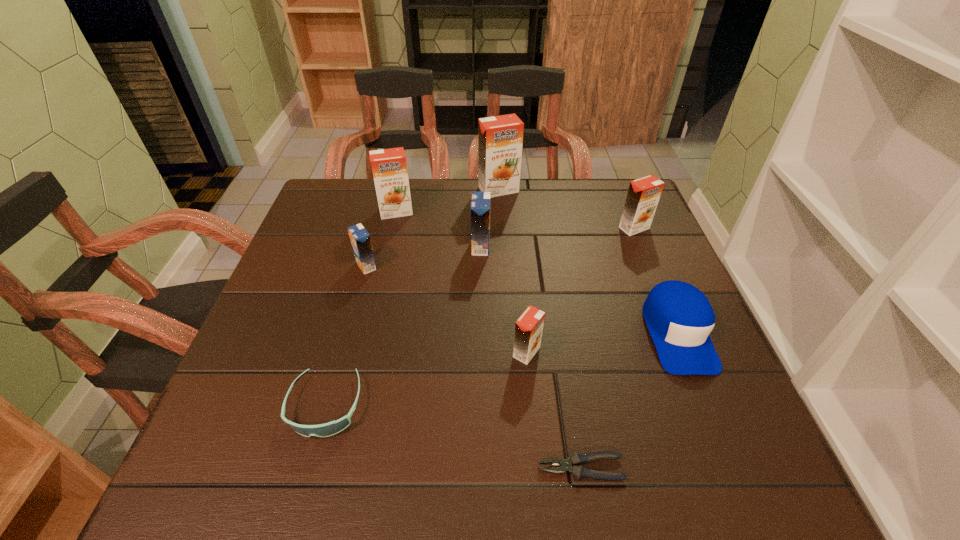
Where is `object that is at the left edge`? The image size is (960, 540). object that is at the left edge is located at coordinates (331, 428).

Find the location of `orange juice that is positioned at the right edge`. orange juice that is positioned at the right edge is located at coordinates (643, 195).

At what (x,y) coordinates should I click in order to perform the action: click on baseball cap that is at the right edge. Please return your answer as a coordinate pair (x, y). Looking at the image, I should click on point(679,317).

Locate an element on the screen. object present at the near left corner is located at coordinates click(x=331, y=428).

Image resolution: width=960 pixels, height=540 pixels. I want to click on object situated at the far right corner, so click(x=643, y=195).

In the image, there is a desktop. Where is `free space at the far edge`? This screenshot has height=540, width=960. free space at the far edge is located at coordinates (467, 207).

In the image, there is a desktop. Identify the location of vacant space at the near edge. Image resolution: width=960 pixels, height=540 pixels. (327, 485).

Where is `vacant space at the left edge of the desktop`? Image resolution: width=960 pixels, height=540 pixels. vacant space at the left edge of the desktop is located at coordinates (264, 334).

In the image, there is a desktop. Where is `vacant area at the right edge`? vacant area at the right edge is located at coordinates (745, 414).

The image size is (960, 540). I want to click on vacant space at the near left corner of the desktop, so click(221, 490).